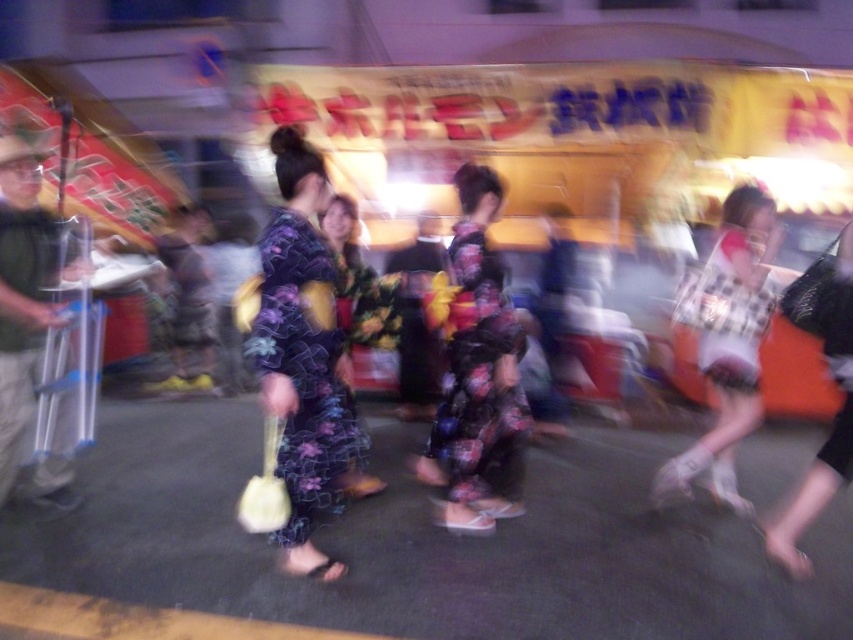
Does floral silk kimono at center appear over floral fabric dress at center?

Indeed, floral silk kimono at center is positioned over floral fabric dress at center.

The image size is (853, 640). What do you see at coordinates (305, 372) in the screenshot? I see `floral silk kimono at center` at bounding box center [305, 372].

Identify the location of floral silk kimono at center. 305,372.

This screenshot has width=853, height=640. What do you see at coordinates (305, 372) in the screenshot? I see `floral silk kimono at center` at bounding box center [305, 372].

Does point (329, 257) come farther from viewer compared to point (747, 326)?

No.

Locate an element on the screen. Image resolution: width=853 pixels, height=640 pixels. floral silk kimono at center is located at coordinates (305, 372).

Does floral silk kimono at center appear over floral fabric kimono at center?

Actually, floral silk kimono at center is below floral fabric kimono at center.

Does point (265, 332) lie behind point (376, 291)?

No, (265, 332) is in front of (376, 291).

Does point (294, 269) lie in front of point (370, 328)?

That is True.

Image resolution: width=853 pixels, height=640 pixels. I want to click on floral silk kimono at center, so click(305, 372).